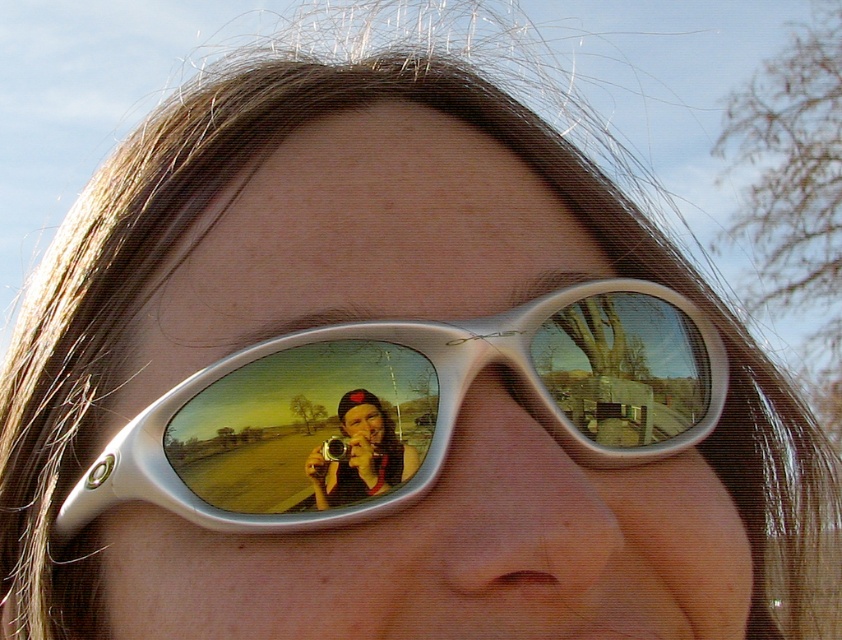
Is white glossy sunglasses at center taller than metallic silver camera at center?

Indeed, white glossy sunglasses at center has a greater height compared to metallic silver camera at center.

The width and height of the screenshot is (842, 640). What are the coordinates of `white glossy sunglasses at center` in the screenshot? It's located at (408, 406).